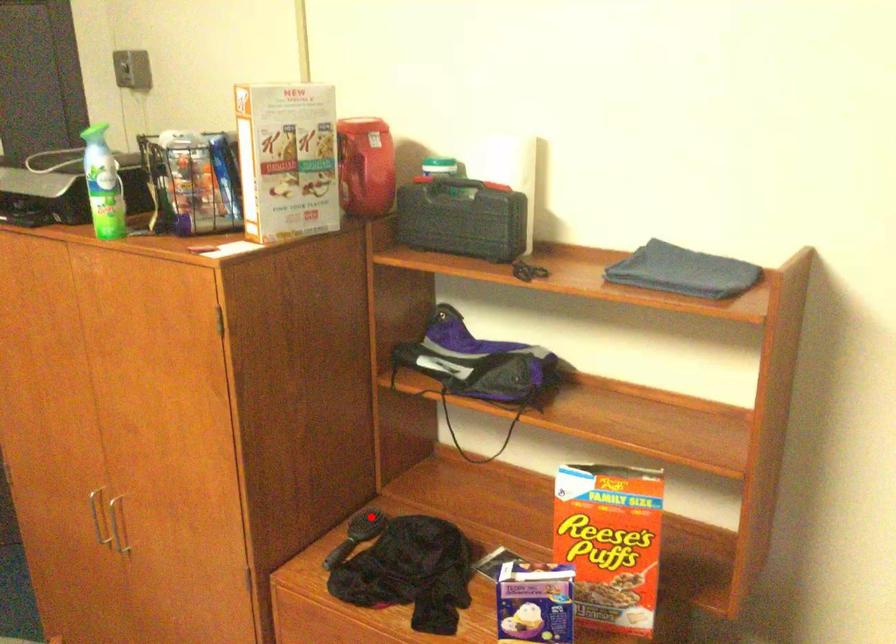
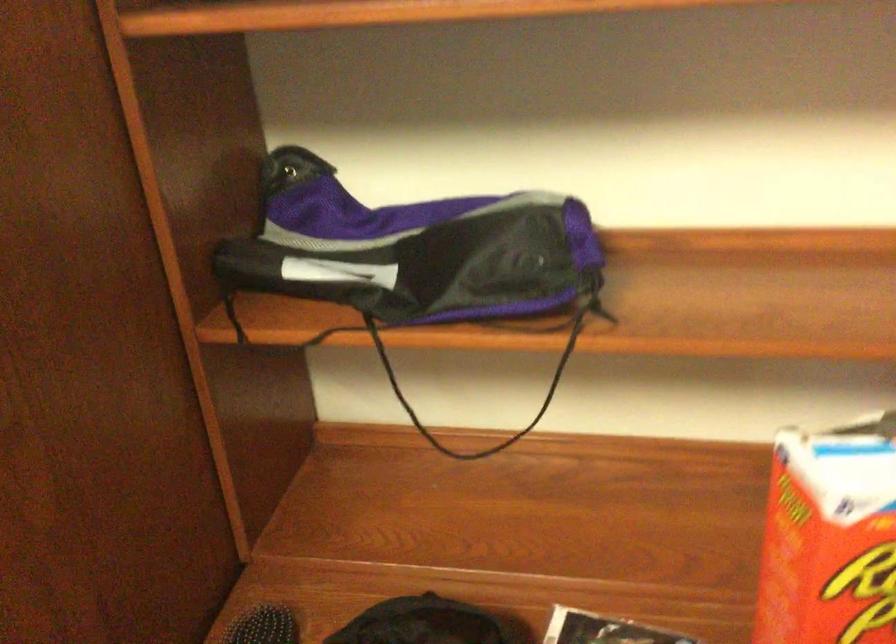
Find the pixel in the second image that matches the highlighted location in the first image.

(263, 626)